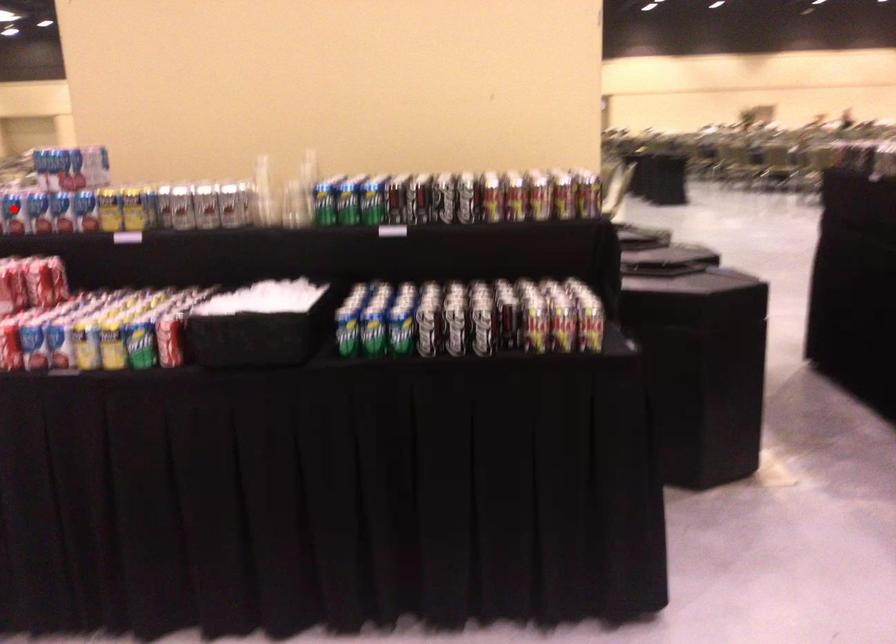
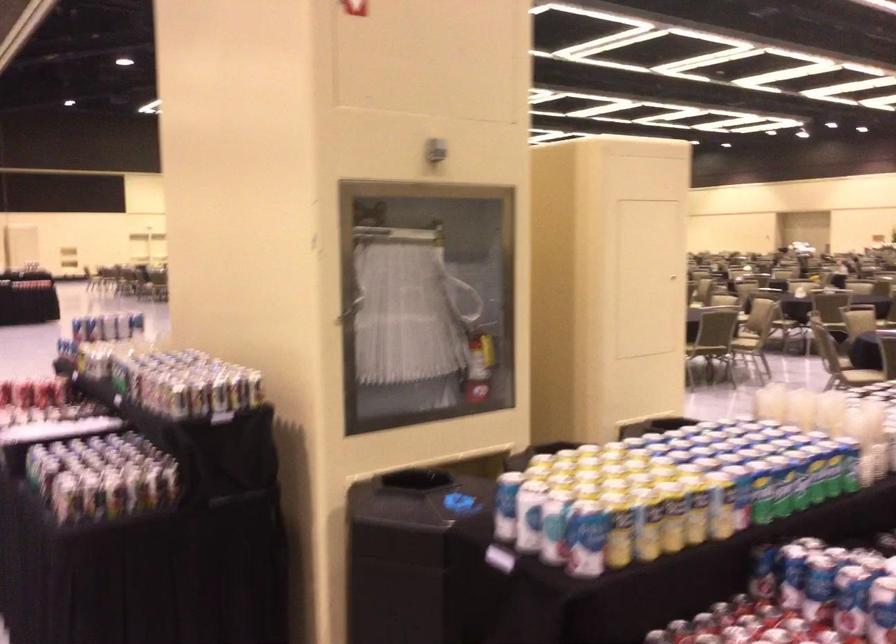
Question: I am providing you with two images of the same scene from different viewpoints. A red point is marked on the first image. At the location where the point appears in image 1, is it still visible in image 2?

Choices:
 (A) Yes
 (B) No

Answer: (B)